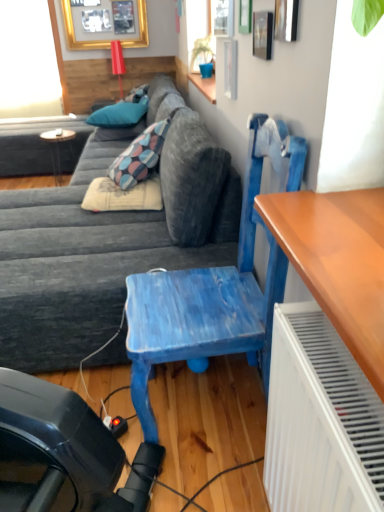
Question: Looking at their shapes, would you say green matte plant at upper center is wider or thinner than transparent glass window screen at upper left?

Choices:
 (A) wide
 (B) thin

Answer: (A)

Question: Is green matte plant at upper center to the left or to the right of transparent glass window screen at upper left in the image?

Choices:
 (A) left
 (B) right

Answer: (B)

Question: Which object is positioned closest to the textured gray couch at center?

Choices:
 (A) blue painted wood chair at center
 (B) wooden round table at left
 (C) beige fabric pillow at center, positioned as the first pillow in front-to-back order
 (D) teal fabric pillow at upper center, the 2th pillow positioned from the front
 (E) gold framed picture at upper left

Answer: (C)

Question: Considering the real-world distances, which object is closest to the beige fabric pillow at center, placed as the third pillow when sorted from back to front?

Choices:
 (A) teal fabric pillow at upper center, positioned as the 3th pillow in bottom-to-top order
 (B) blue painted wood chair at center
 (C) wooden round table at left
 (D) gold framed picture at upper left
 (E) textured gray couch at center

Answer: (E)